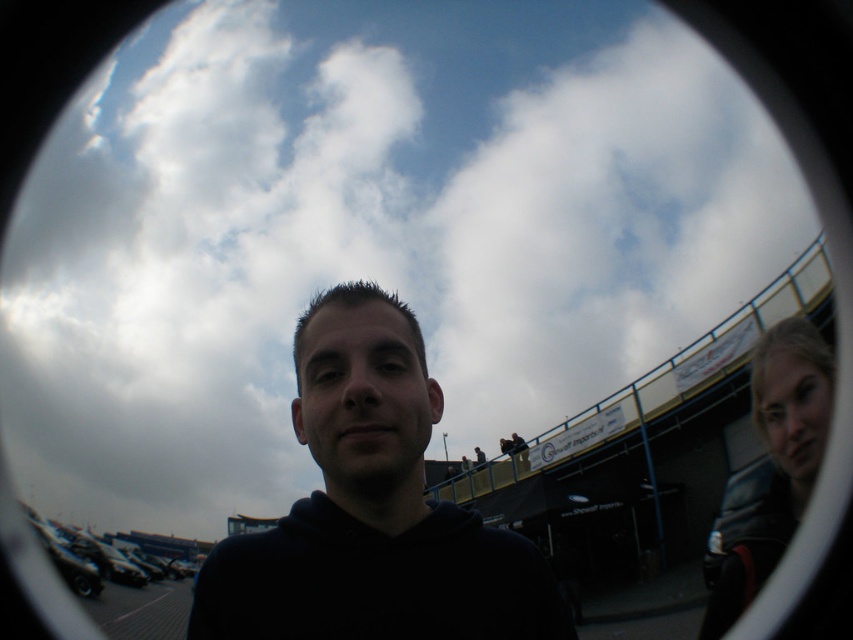
Can you confirm if black matte hoodie at center is shorter than dark gray leather jacket at right?

Yes.

Is black matte hoodie at center to the right of dark gray leather jacket at right from the viewer's perspective?

Incorrect, black matte hoodie at center is not on the right side of dark gray leather jacket at right.

Who is more forward, (363, 602) or (776, 461)?

Point (363, 602) is more forward.

Find the location of `black matte hoodie at center`. black matte hoodie at center is located at coordinates (372, 509).